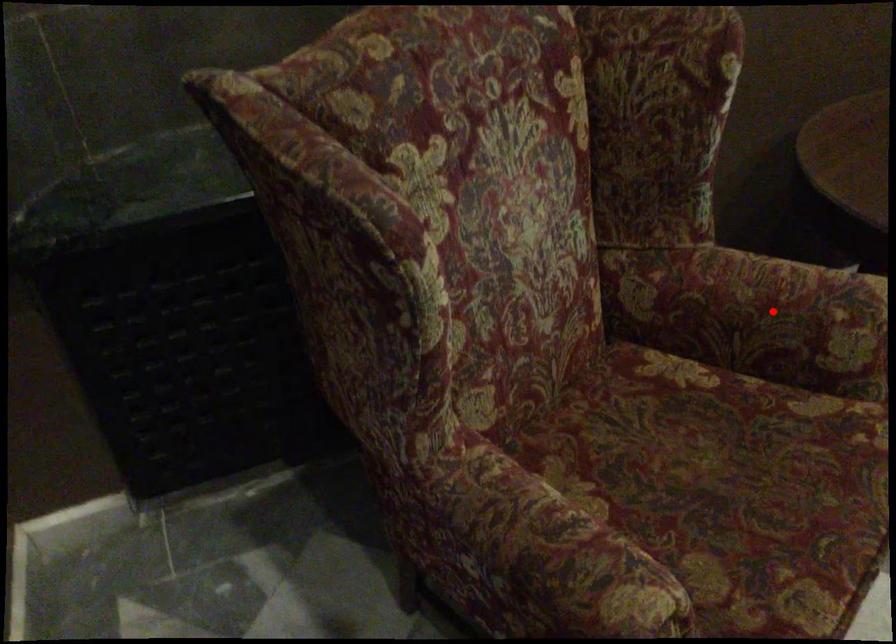
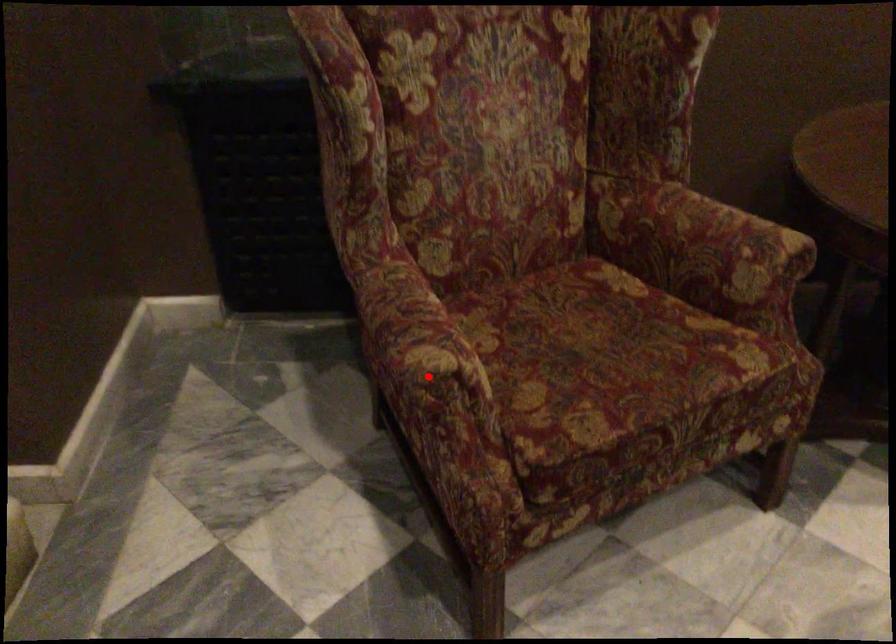
I am providing you with two images of the same scene from different viewpoints. A red point is marked on the first image and another point is marked on the second image. Is the marked point in image1 the same physical position as the marked point in image2?

No